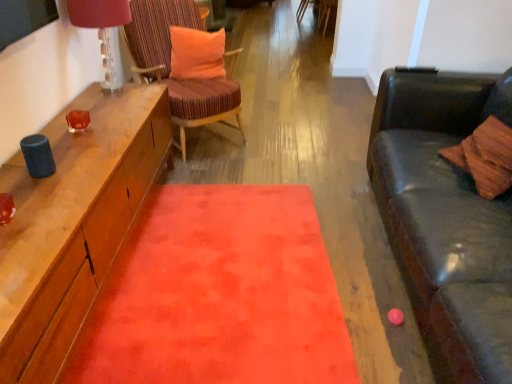
At what (x,y) coordinates should I click in order to perform the action: click on matte glass lampshade at upper left. Please return your answer as a coordinate pair (x, y). This screenshot has height=384, width=512. Looking at the image, I should click on (103, 31).

Describe the element at coordinates (170, 66) in the screenshot. Image resolution: width=512 pixels, height=384 pixels. I see `striped fabric chair at center` at that location.

Locate an element on the screen. The width and height of the screenshot is (512, 384). orange plush pillow at center is located at coordinates (196, 53).

Identify the location of matte glass lampshade at upper left. Image resolution: width=512 pixels, height=384 pixels. (103, 31).

Does striped fabric chair at center have a lesser width compared to velvet orange rug at center?

Correct, the width of striped fabric chair at center is less than that of velvet orange rug at center.

Between striped fabric chair at center and velvet orange rug at center, which one is positioned behind?

striped fabric chair at center is more distant.

Is point (141, 8) more distant than point (246, 208)?

Yes, it is.

Measure the distance between striped fabric chair at center and velvet orange rug at center.

striped fabric chair at center is 1.18 meters away from velvet orange rug at center.

Which of these two, striped fabric chair at center or matte glass lampshade at upper left, stands shorter?

With less height is matte glass lampshade at upper left.

Considering the sizes of objects striped fabric chair at center and matte glass lampshade at upper left in the image provided, who is wider, striped fabric chair at center or matte glass lampshade at upper left?

striped fabric chair at center.

From the image's perspective, is striped fabric chair at center positioned above or below matte glass lampshade at upper left?

striped fabric chair at center is above matte glass lampshade at upper left.

How many degrees apart are the facing directions of striped fabric chair at center and matte glass lampshade at upper left?

They differ by 44.6 degrees in their facing directions.

From the image's perspective, between orange plush pillow at center and matte glass lampshade at upper left, who is located below?

matte glass lampshade at upper left, from the image's perspective.

Is orange plush pillow at center oriented towards matte glass lampshade at upper left?

No, orange plush pillow at center is not facing towards matte glass lampshade at upper left.

Which object is further away from the camera taking this photo, orange plush pillow at center or matte glass lampshade at upper left?

orange plush pillow at center is further away from the camera.

From the picture: Considering the sizes of objects orange plush pillow at center and matte glass lampshade at upper left in the image provided, who is bigger, orange plush pillow at center or matte glass lampshade at upper left?

matte glass lampshade at upper left is bigger.

Considering the relative sizes of matte glass lampshade at upper left and striped fabric chair at center in the image provided, is matte glass lampshade at upper left taller than striped fabric chair at center?

No, matte glass lampshade at upper left is not taller than striped fabric chair at center.

Between point (106, 35) and point (234, 88), which one is positioned behind?

The point (234, 88) is more distant.

Based on their sizes in the image, would you say matte glass lampshade at upper left is bigger or smaller than striped fabric chair at center?

matte glass lampshade at upper left is smaller than striped fabric chair at center.

From the image's perspective, does matte glass lampshade at upper left appear lower than striped fabric chair at center?

Yes, from the image's perspective, matte glass lampshade at upper left is below striped fabric chair at center.

Is velvet orange rug at center positioned with its back to orange plush pillow at center?

velvet orange rug at center does not have its back to orange plush pillow at center.

Considering the relative positions of velvet orange rug at center and orange plush pillow at center in the image provided, is velvet orange rug at center in front of orange plush pillow at center?

Yes, velvet orange rug at center is closer to the viewer.

Between velvet orange rug at center and orange plush pillow at center, which one has larger width?

Wider between the two is velvet orange rug at center.

Consider the image. From a real-world perspective, which object rests below the other?

From a 3D spatial view, orange plush pillow at center is below.

In the scene shown: Who is taller, matte glass lampshade at upper left or orange plush pillow at center?

matte glass lampshade at upper left.

Find the location of a particular element. pillow that is behind the matte glass lampshade at upper left is located at coordinates (196, 53).

Would you say velvet orange rug at center contains matte glass lampshade at upper left?

No, velvet orange rug at center does not contain matte glass lampshade at upper left.

Does velvet orange rug at center have a greater width compared to matte glass lampshade at upper left?

Yes, velvet orange rug at center is wider than matte glass lampshade at upper left.

Based on the photo, can you confirm if velvet orange rug at center is taller than matte glass lampshade at upper left?

No, velvet orange rug at center is not taller than matte glass lampshade at upper left.

Considering the relative positions of velvet orange rug at center and matte glass lampshade at upper left in the image provided, is velvet orange rug at center to the left or to the right of matte glass lampshade at upper left?

In the image, velvet orange rug at center appears on the right side of matte glass lampshade at upper left.

Identify the location of chair above the velvet orange rug at center (from the image's perspective). This screenshot has width=512, height=384. point(170,66).

This screenshot has width=512, height=384. Find the location of `lamp located in front of the striped fabric chair at center`. lamp located in front of the striped fabric chair at center is located at coordinates (103, 31).

When comparing their distances from striped fabric chair at center, does matte glass lampshade at upper left or orange plush pillow at center seem closer?

The object closer to striped fabric chair at center is orange plush pillow at center.

Looking at the image, which one is located further to velvet orange rug at center, matte glass lampshade at upper left or striped fabric chair at center?

Among the two, matte glass lampshade at upper left is located further to velvet orange rug at center.

Which object lies further to the anchor point orange plush pillow at center, matte glass lampshade at upper left or striped fabric chair at center?

matte glass lampshade at upper left lies further to orange plush pillow at center than the other object.

In the scene shown: Based on their spatial positions, is orange plush pillow at center or velvet orange rug at center closer to matte glass lampshade at upper left?

orange plush pillow at center is closer to matte glass lampshade at upper left.

When comparing their distances from striped fabric chair at center, does velvet orange rug at center or matte glass lampshade at upper left seem closer?

The object closer to striped fabric chair at center is matte glass lampshade at upper left.

Estimate the real-world distances between objects in this image. Which object is closer to matte glass lampshade at upper left, striped fabric chair at center or orange plush pillow at center?

striped fabric chair at center is closer to matte glass lampshade at upper left.

Based on their spatial positions, is striped fabric chair at center or velvet orange rug at center closer to orange plush pillow at center?

The object closer to orange plush pillow at center is striped fabric chair at center.

Which object lies nearer to the anchor point velvet orange rug at center, matte glass lampshade at upper left or orange plush pillow at center?

matte glass lampshade at upper left.

Find the location of a particular element. The height and width of the screenshot is (384, 512). lamp between striped fabric chair at center and velvet orange rug at center from top to bottom is located at coordinates (103, 31).

Where is `lamp between orange plush pillow at center and velvet orange rug at center in the vertical direction`? Image resolution: width=512 pixels, height=384 pixels. lamp between orange plush pillow at center and velvet orange rug at center in the vertical direction is located at coordinates (103, 31).

Identify the location of chair that lies between orange plush pillow at center and velvet orange rug at center from top to bottom. (170, 66).

At what (x,y) coordinates should I click in order to perform the action: click on chair positioned between matte glass lampshade at upper left and orange plush pillow at center from near to far. Please return your answer as a coordinate pair (x, y). Looking at the image, I should click on (170, 66).